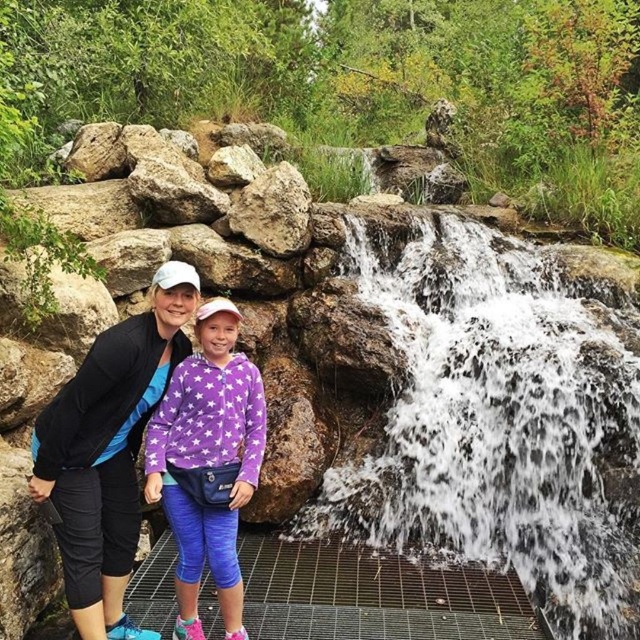
Where is `purple fleece jacket at center`? purple fleece jacket at center is located at coordinates (208, 461).

Is point (250, 381) more distant than point (262, 195)?

No, it is in front of (262, 195).

Is point (220, 445) closer to camera compared to point (268, 186)?

Yes.

Where is `purple fleece jacket at center`? This screenshot has height=640, width=640. purple fleece jacket at center is located at coordinates (208, 461).

Looking at this image, which is above, white frothy water at center or gray rough rock at center?

gray rough rock at center

This screenshot has height=640, width=640. Describe the element at coordinates (497, 428) in the screenshot. I see `white frothy water at center` at that location.

Image resolution: width=640 pixels, height=640 pixels. I want to click on white frothy water at center, so click(497, 428).

Does white frothy water at center have a greater height compared to purple fleece jacket at center?

Yes.

Who is positioned more to the right, white frothy water at center or purple fleece jacket at center?

white frothy water at center is more to the right.

Is point (388, 541) more distant than point (225, 406)?

Yes, point (388, 541) is behind point (225, 406).

The height and width of the screenshot is (640, 640). What are the coordinates of `white frothy water at center` in the screenshot? It's located at (497, 428).